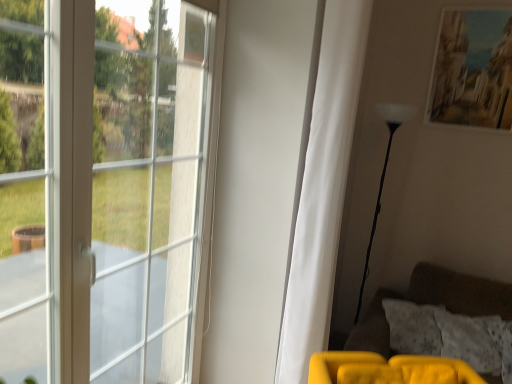
Find the location of a particular element. The width and height of the screenshot is (512, 384). white glossy floor lamp at right is located at coordinates (384, 173).

Find the location of a particular element. Image resolution: width=512 pixels, height=384 pixels. matte paper picture frame at upper right is located at coordinates (473, 70).

Describe the element at coordinates (102, 188) in the screenshot. This screenshot has width=512, height=384. I see `white glass window at left` at that location.

Where is `white matte curtain at center`? white matte curtain at center is located at coordinates (323, 188).

Locate an element on the screen. The height and width of the screenshot is (384, 512). velvet yellow couch at lower right is located at coordinates (426, 334).

What are the coordinates of `white glossy floor lamp at right` in the screenshot? It's located at (384, 173).

Does point (375, 107) come behind point (482, 59)?

That is True.

Is white glossy floor lamp at right oriented towards matte paper picture frame at upper right?

No, white glossy floor lamp at right is not facing towards matte paper picture frame at upper right.

Is white glossy floor lamp at right further to camera compared to matte paper picture frame at upper right?

That is False.

In order to click on window located on the left of matte paper picture frame at upper right in this screenshot , I will do 102,188.

From the image's perspective, does matte paper picture frame at upper right appear lower than white glass window at left?

No, from the image's perspective, matte paper picture frame at upper right is not beneath white glass window at left.

Does matte paper picture frame at upper right have a lesser height compared to white glass window at left?

Indeed, matte paper picture frame at upper right has a lesser height compared to white glass window at left.

Considering the relative sizes of fluffy white pillow at lower right and velvet yellow couch at lower right in the image provided, is fluffy white pillow at lower right smaller than velvet yellow couch at lower right?

Correct, fluffy white pillow at lower right occupies less space than velvet yellow couch at lower right.

Considering the relative sizes of fluffy white pillow at lower right and velvet yellow couch at lower right in the image provided, is fluffy white pillow at lower right shorter than velvet yellow couch at lower right?

Correct, fluffy white pillow at lower right is not as tall as velvet yellow couch at lower right.

Is fluffy white pillow at lower right behind velvet yellow couch at lower right?

Yes, the depth of fluffy white pillow at lower right is greater than that of velvet yellow couch at lower right.

Is fluffy white pillow at lower right situated inside velvet yellow couch at lower right or outside?

fluffy white pillow at lower right can be found inside velvet yellow couch at lower right.

From a real-world perspective, is fluffy white pillow at lower right positioned above or below white glass window at left?

From a real-world perspective, fluffy white pillow at lower right is physically below white glass window at left.

Which point is more distant from viewer, (444,352) or (209,83)?

The point (444,352) is more distant.

From the image's perspective, which is above, fluffy white pillow at lower right or white glass window at left?

From the image's view, white glass window at left is above.

Is white glass window at left located outside velvet yellow couch at lower right?

Yes.

Is white glass window at left in front of velvet yellow couch at lower right?

Yes, it is in front of velvet yellow couch at lower right.

Can you confirm if white glass window at left is thinner than velvet yellow couch at lower right?

Correct, the width of white glass window at left is less than that of velvet yellow couch at lower right.

Considering the positions of objects white glossy floor lamp at right and white matte curtain at center in the image provided, who is more to the right, white glossy floor lamp at right or white matte curtain at center?

white glossy floor lamp at right is more to the right.

How far apart are white glossy floor lamp at right and white matte curtain at center?

white glossy floor lamp at right is 3.80 feet away from white matte curtain at center.

Which of these two, white glossy floor lamp at right or white matte curtain at center, stands taller?

With more height is white matte curtain at center.

Is white glossy floor lamp at right outside of white matte curtain at center?

Yes.

This screenshot has width=512, height=384. Identify the location of lamp directly beneath the matte paper picture frame at upper right (from a real-world perspective). (384, 173).

Which object is closer to the camera, matte paper picture frame at upper right or white glossy floor lamp at right?

Positioned in front is white glossy floor lamp at right.

Is matte paper picture frame at upper right oriented towards white glossy floor lamp at right?

No.

How much distance is there between matte paper picture frame at upper right and white glossy floor lamp at right?

matte paper picture frame at upper right and white glossy floor lamp at right are 17.55 inches apart.

Find the location of a particular element. The width and height of the screenshot is (512, 384). picture frame behind the white glossy floor lamp at right is located at coordinates pyautogui.click(x=473, y=70).

There is a white glass window at left. Where is `picture frame above it (from a real-world perspective)`? The height and width of the screenshot is (384, 512). picture frame above it (from a real-world perspective) is located at coordinates (473, 70).

Estimate the real-world distances between objects in this image. Which object is further from velvet yellow couch at lower right, white glass window at left or fluffy white pillow at lower right?

white glass window at left is further to velvet yellow couch at lower right.

Based on their spatial positions, is velvet yellow couch at lower right or white glass window at left closer to fluffy white pillow at lower right?

Based on the image, velvet yellow couch at lower right appears to be nearer to fluffy white pillow at lower right.

Estimate the real-world distances between objects in this image. Which object is closer to white matte curtain at center, matte paper picture frame at upper right or white glossy floor lamp at right?

white glossy floor lamp at right is positioned closer to the anchor white matte curtain at center.

When comparing their distances from fluffy white pillow at lower right, does white glass window at left or velvet yellow couch at lower right seem further?

white glass window at left.

Considering their positions, is velvet yellow couch at lower right positioned further to matte paper picture frame at upper right than fluffy white pillow at lower right?

fluffy white pillow at lower right.

Considering their positions, is fluffy white pillow at lower right positioned closer to matte paper picture frame at upper right than white glossy floor lamp at right?

white glossy floor lamp at right lies closer to matte paper picture frame at upper right than the other object.

Looking at the image, which one is located closer to white glossy floor lamp at right, white glass window at left or velvet yellow couch at lower right?

velvet yellow couch at lower right is positioned closer to the anchor white glossy floor lamp at right.

Estimate the real-world distances between objects in this image. Which object is further from white matte curtain at center, white glossy floor lamp at right or velvet yellow couch at lower right?

white glossy floor lamp at right is positioned further to the anchor white matte curtain at center.

What are the coordinates of `lamp between white glass window at left and matte paper picture frame at upper right in the horizontal direction` in the screenshot? It's located at (384, 173).

Find the location of `curtain situated between white glass window at left and matte paper picture frame at upper right from left to right`. curtain situated between white glass window at left and matte paper picture frame at upper right from left to right is located at coordinates (323, 188).

Where is `lamp between white matte curtain at center and fluffy white pillow at lower right`? The width and height of the screenshot is (512, 384). lamp between white matte curtain at center and fluffy white pillow at lower right is located at coordinates (384, 173).

Identify the location of lamp between matte paper picture frame at upper right and velvet yellow couch at lower right vertically. The width and height of the screenshot is (512, 384). (384, 173).